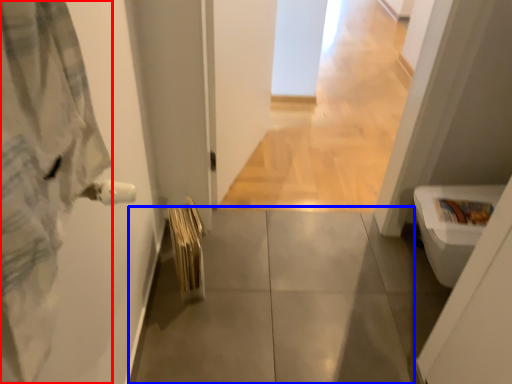
Question: Which object is closer to the camera taking this photo, bathrobe (highlighted by a red box) or concrete (highlighted by a blue box)?

Choices:
 (A) bathrobe
 (B) concrete

Answer: (A)